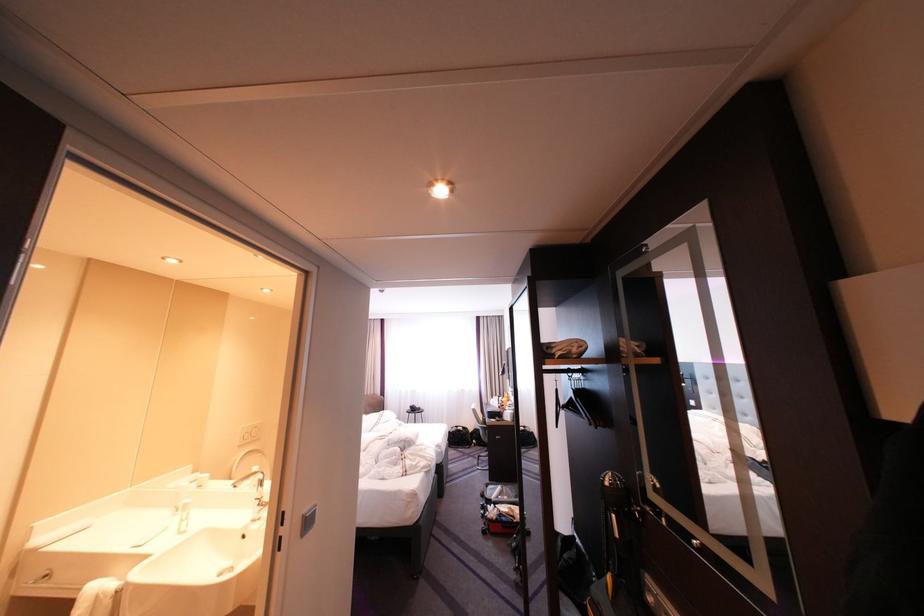
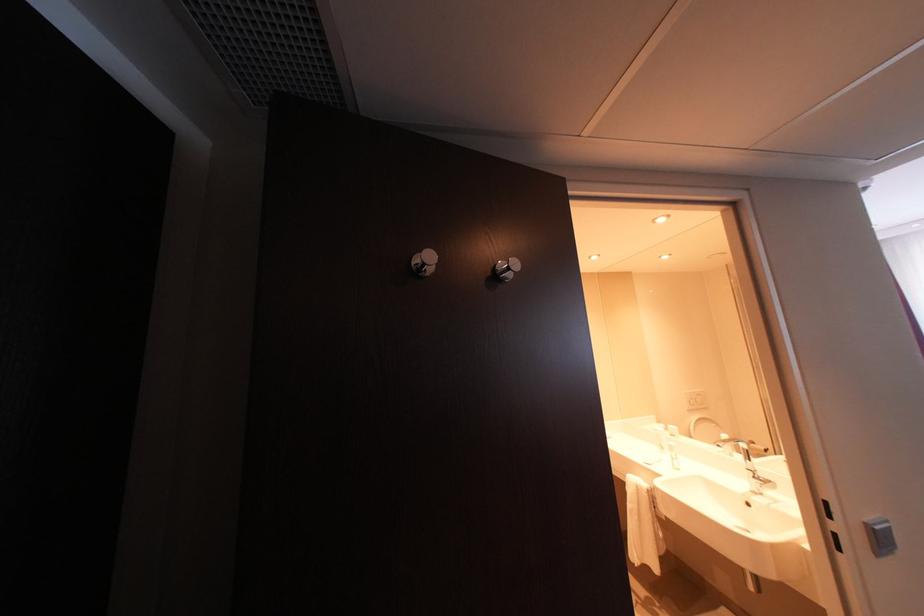
Question: How did the camera likely rotate?

Choices:
 (A) Left
 (B) Right
 (C) Up
 (D) Down

Answer: (A)